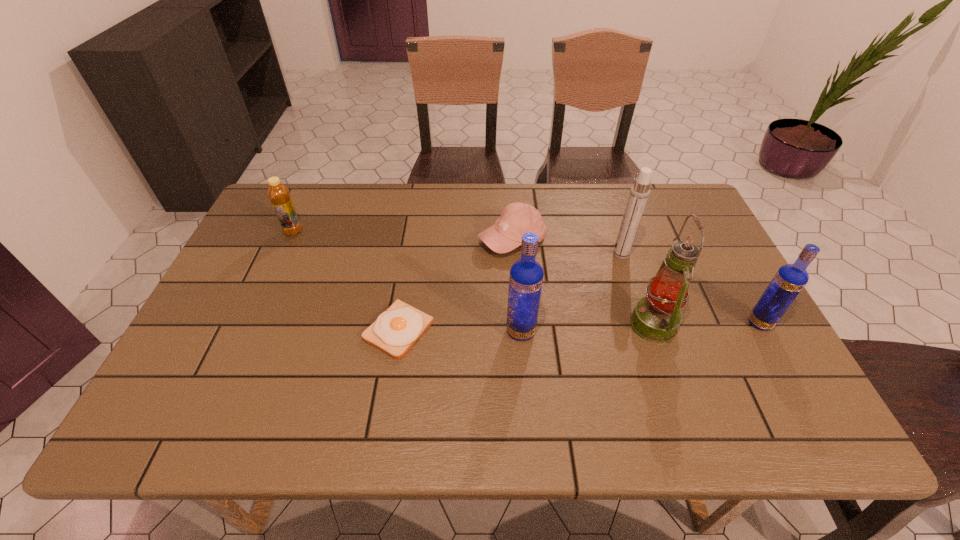
I want to click on vacant point located 0.340m on the right of the taller vodka, so click(x=675, y=331).

Image resolution: width=960 pixels, height=540 pixels. Identify the location of vacant space situated 0.070m on the back of the right vodka. (743, 293).

At what (x,y) coordinates should I click in order to perform the action: click on free location located 0.290m on the front-facing side of the second shortest object. Please return your answer as a coordinate pair (x, y). This screenshot has width=960, height=540. Looking at the image, I should click on (520, 345).

The height and width of the screenshot is (540, 960). I want to click on free location located on the back of the third shortest object, so click(310, 195).

The image size is (960, 540). I want to click on vacant space located 0.070m on the left of the aerosol can, so point(588,254).

You are a GUI agent. You are given a task and a screenshot of the screen. Output one action in this format:
    pyautogui.click(x=<x>, y=<y>)
    Task: Click on the vacant space positioned 0.160m on the left of the oil lamp
    The height and width of the screenshot is (540, 960).
    Given the screenshot: What is the action you would take?
    pyautogui.click(x=565, y=325)

Where is `vacant space located 0.180m on the right of the second object from left to right`? This screenshot has width=960, height=540. vacant space located 0.180m on the right of the second object from left to right is located at coordinates (507, 330).

Locate an element on the screen. The image size is (960, 540). baseball cap that is at the far edge is located at coordinates (516, 219).

Image resolution: width=960 pixels, height=540 pixels. Find the location of `bottle positioned at the far edge`. bottle positioned at the far edge is located at coordinates (279, 195).

The image size is (960, 540). I want to click on object positioned at the near edge, so click(x=396, y=330).